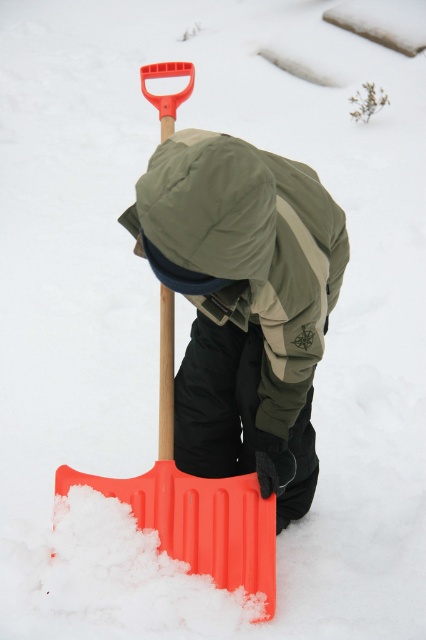
Between green matte jacket at center and orange plastic shovel at center, which one is positioned higher?

green matte jacket at center is higher up.

Does green matte jacket at center have a smaller size compared to orange plastic shovel at center?

Actually, green matte jacket at center might be larger than orange plastic shovel at center.

The height and width of the screenshot is (640, 426). I want to click on green matte jacket at center, so [x=249, y=252].